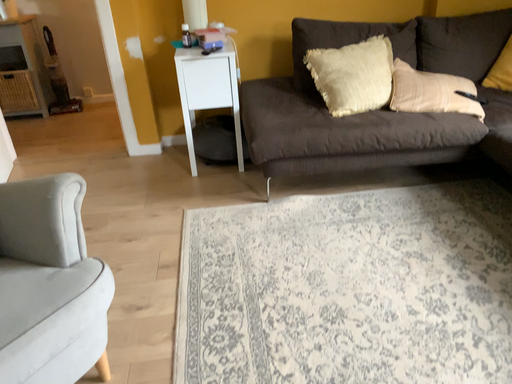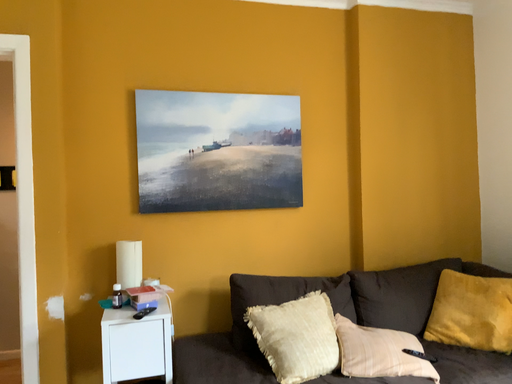
Question: Which way did the camera rotate in the video?

Choices:
 (A) rotated left
 (B) rotated right

Answer: (B)